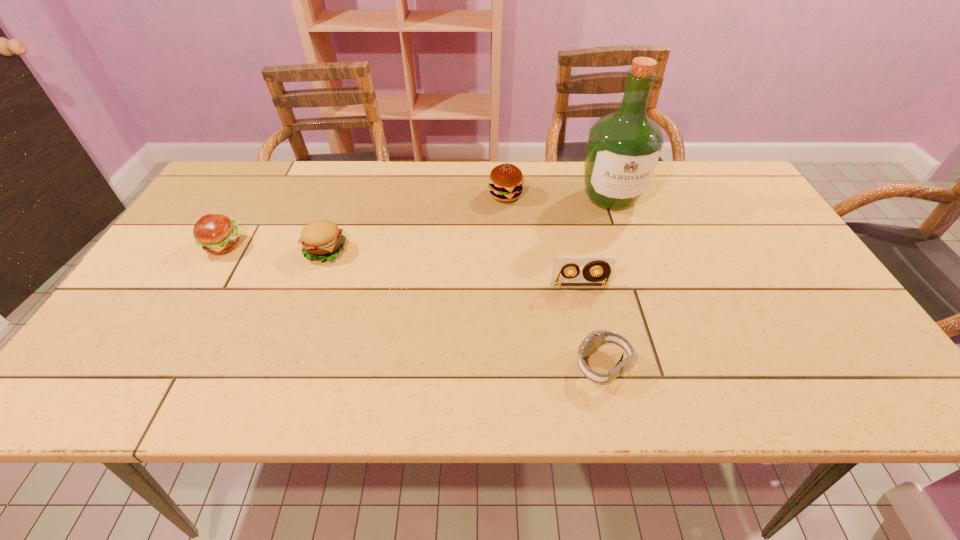
Where is `liquor`? liquor is located at coordinates (623, 150).

The width and height of the screenshot is (960, 540). I want to click on the rightmost hamburger, so click(x=505, y=184).

Where is `the third object from left to right`? This screenshot has width=960, height=540. the third object from left to right is located at coordinates (505, 184).

Locate an element on the screen. The width and height of the screenshot is (960, 540). videotape is located at coordinates (605, 265).

The width and height of the screenshot is (960, 540). I want to click on the leftmost hamburger, so click(x=217, y=234).

At what (x,y) coordinates should I click in order to perform the action: click on the second hamburger from left to right. Please return your answer as a coordinate pair (x, y). Image resolution: width=960 pixels, height=540 pixels. Looking at the image, I should click on [322, 240].

I want to click on the nearest object, so click(x=596, y=339).

Locate an element on the screen. This screenshot has width=960, height=540. free space located on the front-facing side of the tallest object is located at coordinates (640, 284).

Find the location of a particular element. The height and width of the screenshot is (540, 960). vacant space located 0.280m on the front of the farthest hamburger is located at coordinates (511, 275).

Where is `vacant space located 0.100m at the front of the second nearest object with visible reels`? The image size is (960, 540). vacant space located 0.100m at the front of the second nearest object with visible reels is located at coordinates (588, 320).